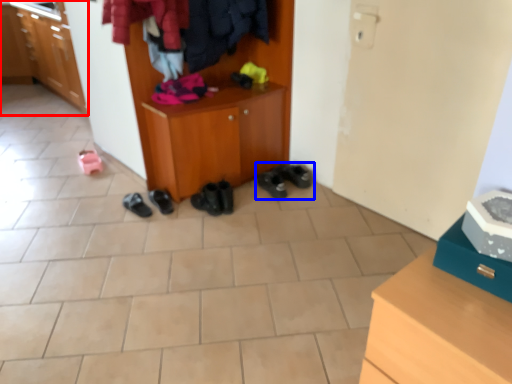
Question: Which object is closer to the camera taking this photo, cabinetry (highlighted by a red box) or footwear (highlighted by a blue box)?

Choices:
 (A) cabinetry
 (B) footwear

Answer: (B)